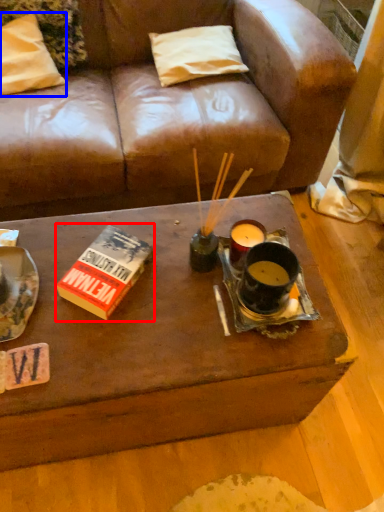
Question: Which point is further to the camera, paperback book (highlighted by a red box) or pillow (highlighted by a blue box)?

Choices:
 (A) paperback book
 (B) pillow

Answer: (B)